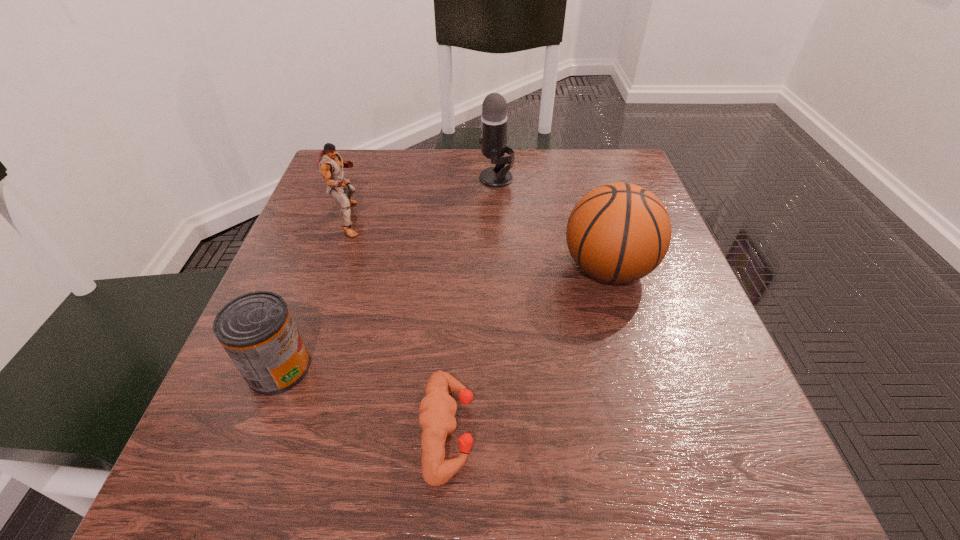
Identify the location of vacant space situated 0.260m on the left of the basketball. (424, 268).

Locate an element on the screen. Image resolution: width=960 pixels, height=540 pixels. vacant region located 0.260m on the back of the can is located at coordinates (327, 240).

What are the coordinates of `free space located 0.060m with the gloves of the third object from left to right facing forward` in the screenshot? It's located at (517, 430).

At what (x,y) coordinates should I click in order to perform the action: click on microphone that is at the far edge. Please return your answer as a coordinate pair (x, y). Looking at the image, I should click on (494, 118).

You are a GUI agent. You are given a task and a screenshot of the screen. Output one action in this format:
    pyautogui.click(x=<x>, y=<y>)
    Task: Click on the puncher that is at the far edge
    The height and width of the screenshot is (540, 960).
    Given the screenshot: What is the action you would take?
    pyautogui.click(x=331, y=165)

Identify the location of object positioned at the near edge. The height and width of the screenshot is (540, 960). (438, 409).

Find the location of a particular element. This screenshot has width=960, height=540. puncher that is at the left edge is located at coordinates (331, 165).

Identify the location of can that is positioned at the left edge. (257, 330).

This screenshot has width=960, height=540. Find the location of `object that is at the right edge`. object that is at the right edge is located at coordinates (619, 232).

Where is `object at the far left corner`? This screenshot has height=540, width=960. object at the far left corner is located at coordinates (331, 165).